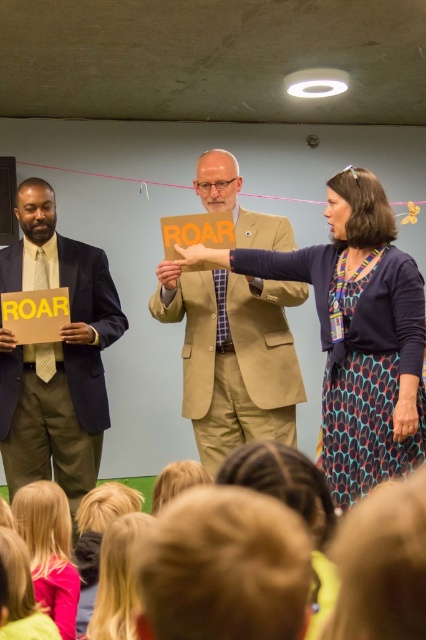
Can you confirm if matte orange sign at center is shorter than tan fabric suit at center?

Yes.

Is matte orange sign at center below tan fabric suit at center?

Correct, matte orange sign at center is located below tan fabric suit at center.

From the picture: Who is more distant from viewer, (377, 324) or (213, 374)?

The point (213, 374) is more distant.

Image resolution: width=426 pixels, height=640 pixels. Identify the location of matte orange sign at center. (356, 333).

Does point (386, 250) lie behind point (9, 352)?

That is False.

Is matte orange sign at center wider than matte black suit at left?

Yes.

Between point (354, 401) and point (77, 358), which one is positioned in front?

Point (354, 401)

Locate an element on the screen. Image resolution: width=426 pixels, height=640 pixels. matte orange sign at center is located at coordinates pos(356,333).

Who is more distant from viewer, (233, 330) or (106, 292)?

The point (106, 292) is behind.

Can you confirm if tan fabric suit at center is positioned below matte black suit at left?

Incorrect, tan fabric suit at center is not positioned below matte black suit at left.

Which is behind, point (230, 163) or point (20, 356)?

The point (20, 356) is more distant.

This screenshot has height=640, width=426. I want to click on tan fabric suit at center, so click(x=233, y=356).